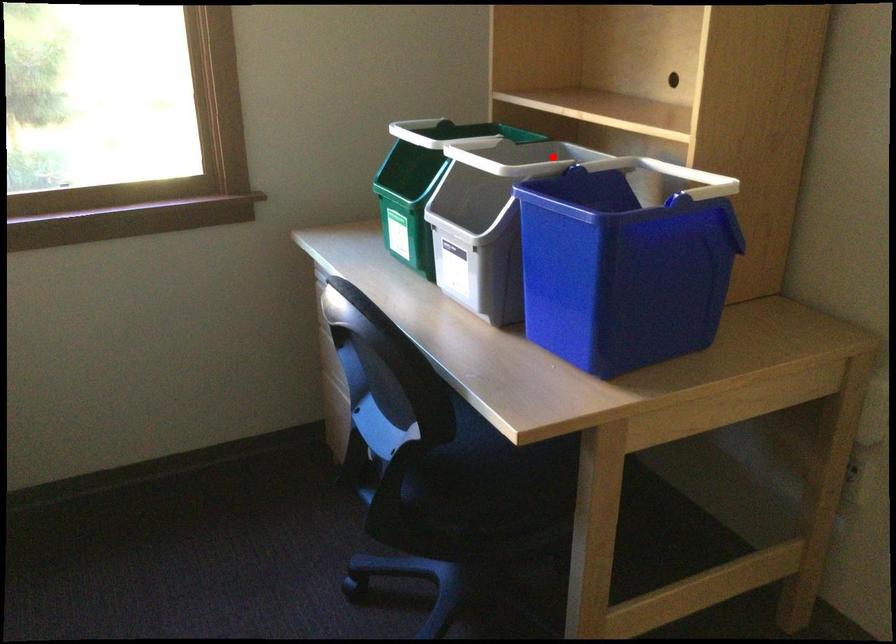
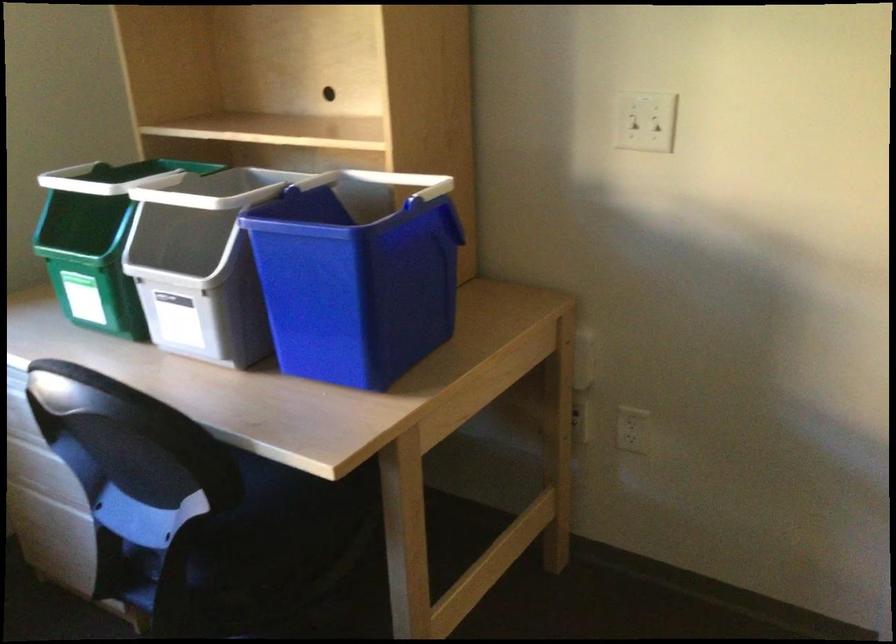
Locate, in the second image, the point that corresponds to the highlighted location in the first image.

(245, 185)